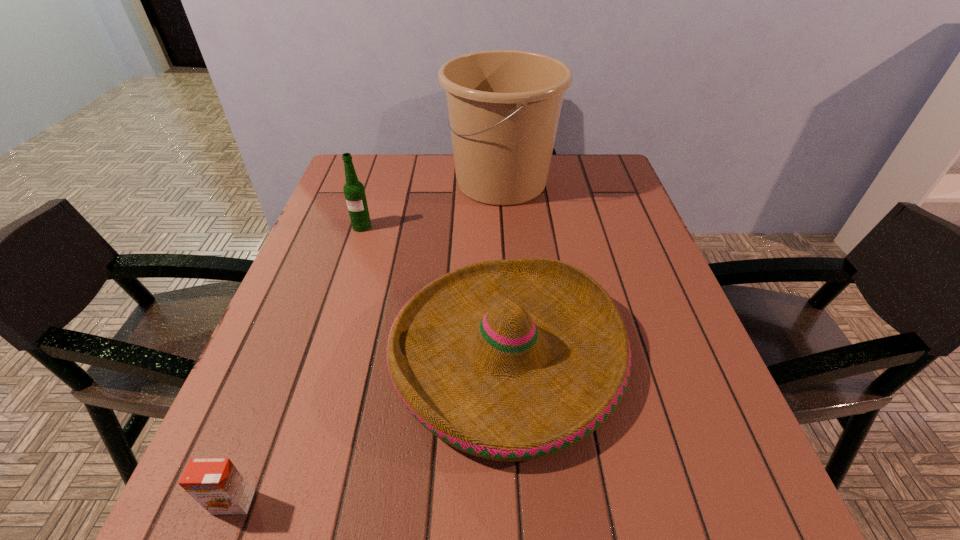
You are a GUI agent. You are given a task and a screenshot of the screen. Output one action in this format:
    pyautogui.click(x=<x>, y=<y>)
    Task: Click on the empty location between the sombrero and the nearest object
    The width and height of the screenshot is (960, 540).
    Given the screenshot: What is the action you would take?
    pyautogui.click(x=371, y=428)

Where is `vacant area that lies between the sombrero and the orange juice`? This screenshot has width=960, height=540. vacant area that lies between the sombrero and the orange juice is located at coordinates (371, 428).

Locate which object ranks second in proximity to the second object from left to right. Please provide its 2D coordinates. Your answer should be formatted as a tuple, i.e. [(x, y)], where the tuple contains the x and y coordinates of a point satisfying the conditions above.

[(511, 360)]

Find the location of a particular element. The height and width of the screenshot is (540, 960). the second closest object to the second nearest object is located at coordinates (354, 191).

Locate an element on the screen. The width and height of the screenshot is (960, 540). free location that satisfies the following two spatial constraints: 1. on the label of the second tallest object; 2. on the left side of the sombrero is located at coordinates (321, 353).

Locate an element on the screen. This screenshot has width=960, height=540. blank area in the image that satisfies the following two spatial constraints: 1. on the label of the beer bottle; 2. on the left side of the third tallest object is located at coordinates (321, 353).